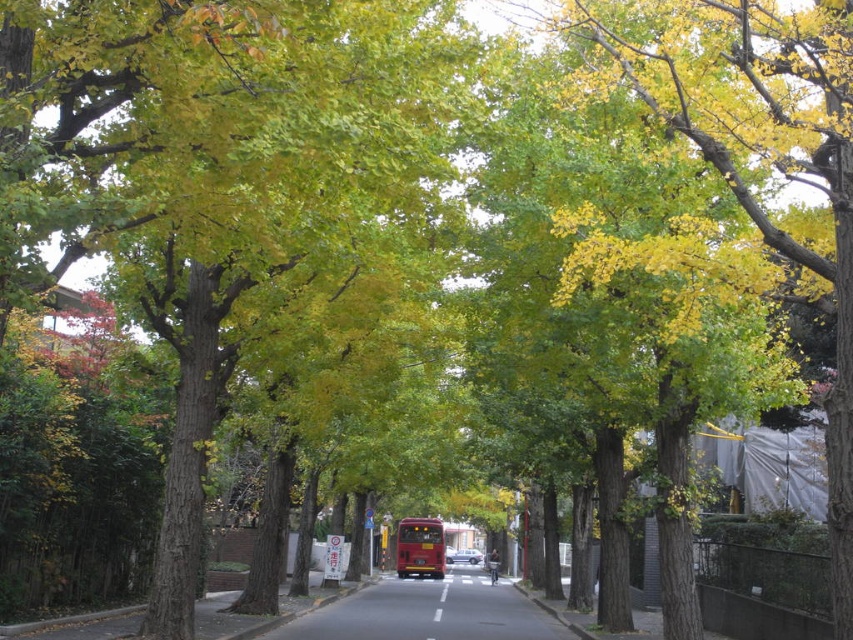
Is point (421, 516) closer to camera compared to point (473, 556)?

Yes.

Locate an element on the screen. shiny red bus at center is located at coordinates (421, 547).

Between point (436, 541) and point (480, 554), which one is positioned in front?

Point (436, 541) is in front.

This screenshot has width=853, height=640. I want to click on shiny red bus at center, so click(421, 547).

Who is shorter, smooth asphalt road at center or shiny red bus at center?

shiny red bus at center

Who is more distant from viewer, (x=450, y=604) or (x=422, y=557)?

Point (x=422, y=557)

Where is `smooth asphalt road at center`? smooth asphalt road at center is located at coordinates (427, 612).

Consider the image. Between smooth asphalt road at center and metallic silver car at center, which one has more height?

smooth asphalt road at center is taller.

Can you confirm if smooth asphalt road at center is taller than metallic silver car at center?

Yes.

Locate an element on the screen. smooth asphalt road at center is located at coordinates (427, 612).

Find the location of a particular element. This screenshot has width=853, height=640. smooth asphalt road at center is located at coordinates (427, 612).